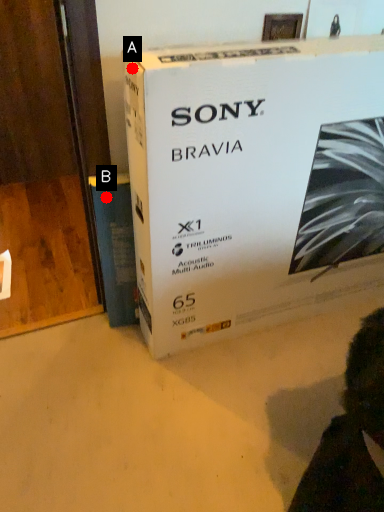
Question: Two points are circled on the image, labeled by A and B beside each circle. Which point appears farthest from the camera in this image?

Choices:
 (A) A is further
 (B) B is further

Answer: (B)